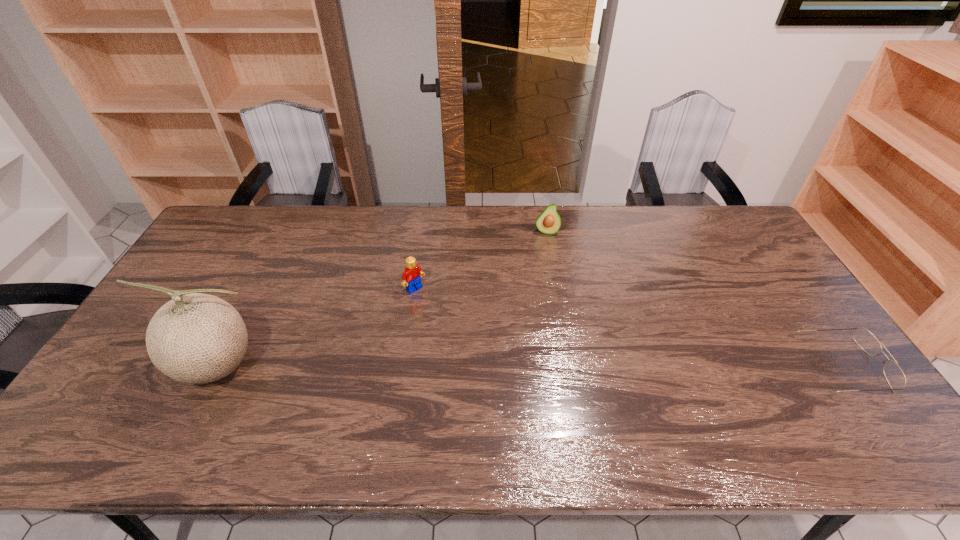
The image size is (960, 540). What are the coordinates of `free area in between the farthest object and the spectacles` in the screenshot? It's located at (695, 299).

Where is `free space between the second farthest object and the avocado`? The image size is (960, 540). free space between the second farthest object and the avocado is located at coordinates pyautogui.click(x=481, y=260).

The image size is (960, 540). Find the location of `unoccupied position between the tallest object and the third nearest object`. unoccupied position between the tallest object and the third nearest object is located at coordinates (315, 327).

I want to click on free space that is in between the spectacles and the tallest object, so click(x=529, y=366).

The height and width of the screenshot is (540, 960). What are the coordinates of `vacant point located between the tallest object and the farthest object` in the screenshot? It's located at (380, 299).

Locate an element on the screen. This screenshot has width=960, height=540. free space between the third object from left to right and the second farthest object is located at coordinates (481, 260).

Point out which object is positioned as the nearest to the second farthest object. Please provide its 2D coordinates. Your answer should be formatted as a tuple, i.e. [(x, y)], where the tuple contains the x and y coordinates of a point satisfying the conditions above.

[(197, 338)]

Find the location of a particular element. The height and width of the screenshot is (540, 960). object that is the closest to the third object from left to right is located at coordinates (411, 277).

The height and width of the screenshot is (540, 960). Find the location of `free space that satisfies the following two spatial constraints: 1. on the back side of the tallest object; 2. on the right side of the second object from right to left`. free space that satisfies the following two spatial constraints: 1. on the back side of the tallest object; 2. on the right side of the second object from right to left is located at coordinates (283, 232).

In order to click on vacant region that satisfies the following two spatial constraints: 1. on the front side of the avocado; 2. on the front-facing side of the shortest object in this screenshot , I will do `click(570, 366)`.